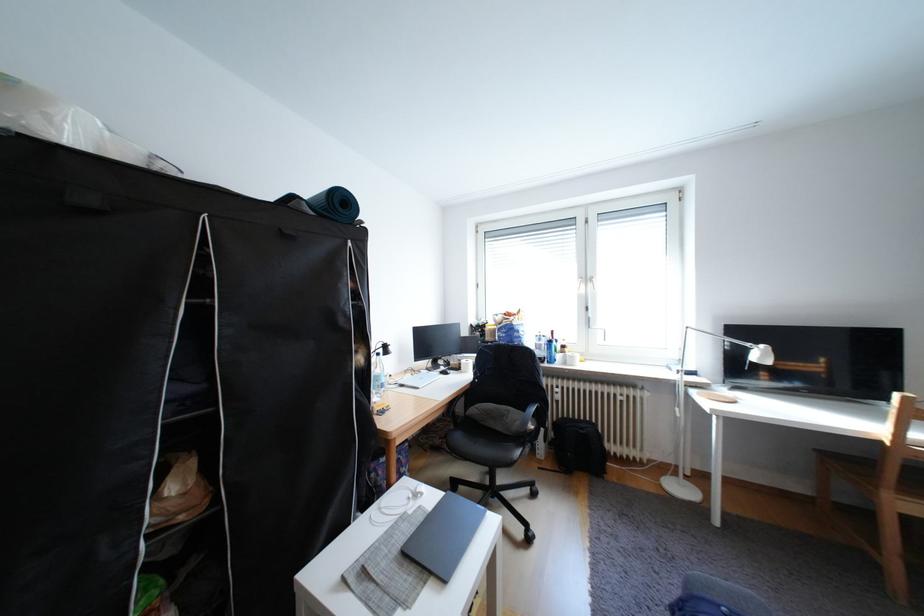
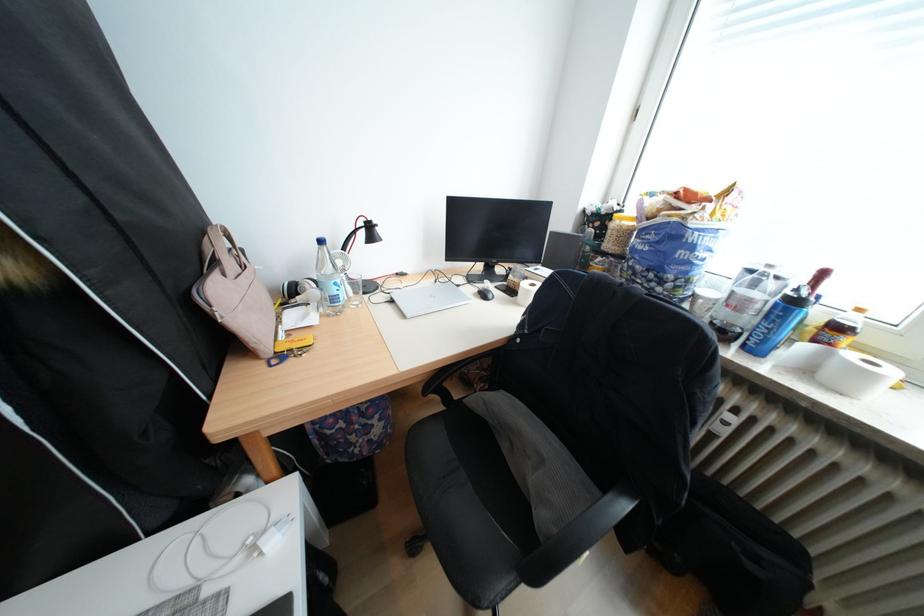
The point at (415, 387) is marked in the first image. Where is the corresponding point in the second image?

(405, 302)